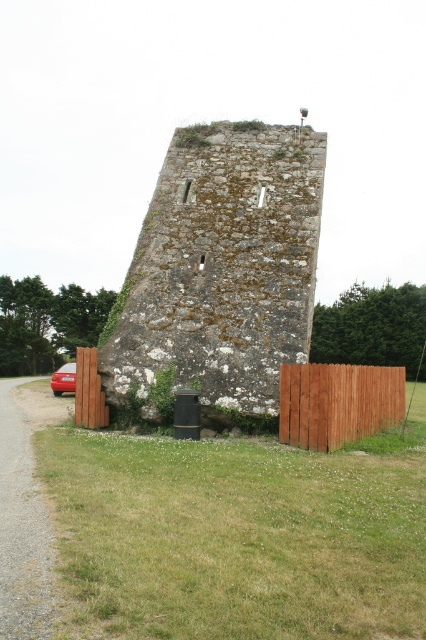
Question: Which point is farther from the camera taking this photo?

Choices:
 (A) (54, 378)
 (B) (262, 176)

Answer: (A)

Question: Where is rusty stone tower at center located in relation to brown wooden fence at lower left in the image?

Choices:
 (A) above
 (B) below

Answer: (A)

Question: Which point is farther to the camera?

Choices:
 (A) (305, 388)
 (B) (143, 221)
 (C) (91, 387)
 (D) (65, 368)

Answer: (D)

Question: Does brown wooden fence at lower left appear on the right side of shiny red sedan at left?

Choices:
 (A) no
 (B) yes

Answer: (B)

Question: Among these objects, which one is farthest from the camera?

Choices:
 (A) rusty stone tower at center
 (B) brown wooden fence at lower left
 (C) brown wooden fence at lower right

Answer: (B)

Question: Is brown wooden fence at lower left to the right of shiny red sedan at left from the viewer's perspective?

Choices:
 (A) yes
 (B) no

Answer: (A)